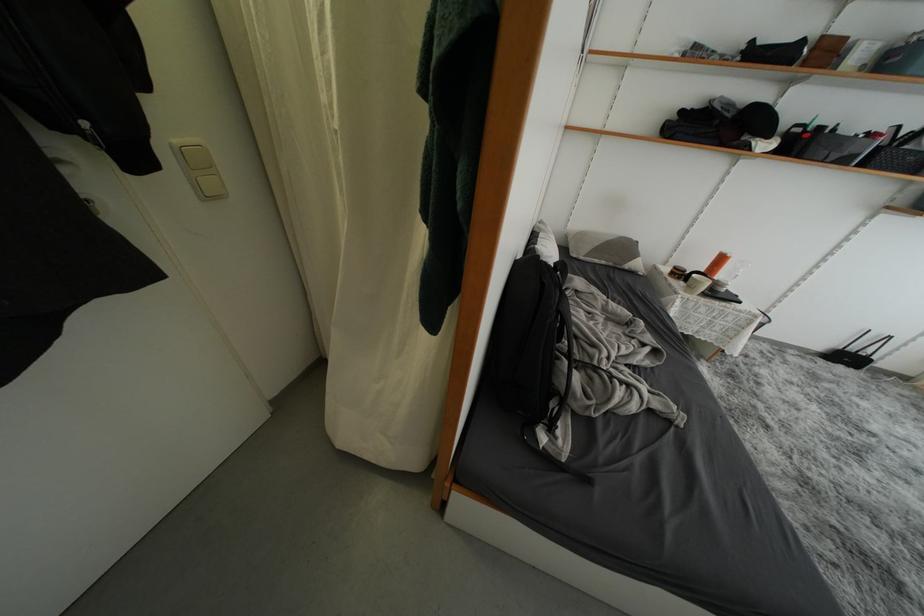
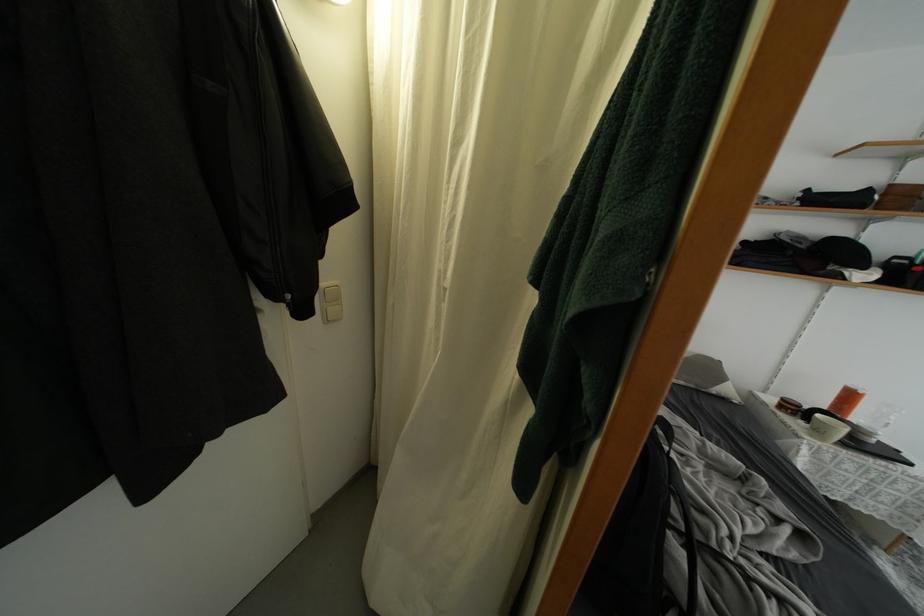
Locate, in the second image, the point that corresponds to (649,328) in the first image.

(769, 485)